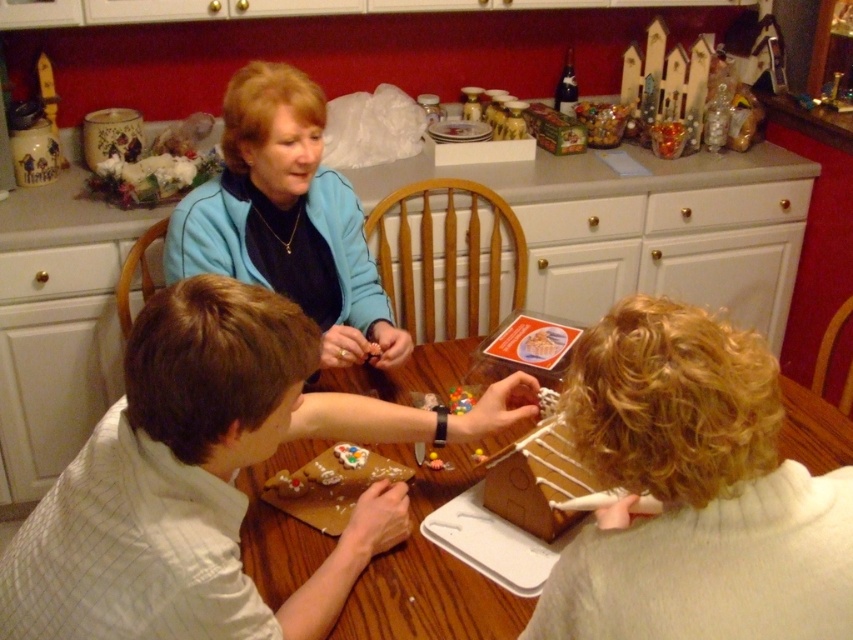
You are standing in the kitchen and want to place a large bowl of ingredients on the wooden table at center. However, there is a blue fleece jacket at upper center in the way. Can you place the bowl on the table without moving the jacket?

The wooden table at center is behind the blue fleece jacket at upper center, so the jacket is blocking access to the table. You would need to move the jacket or navigate around it to place the bowl on the table.

You are organizing a craft event and need to ensure there is enough space for participants. Given the blue fleece jacket at upper center and the wooden table at center, which object takes up more space in the scene?

The wooden table at center takes up more space than the blue fleece jacket at upper center because the blue fleece jacket at upper center has a smaller size compared to wooden table at center.